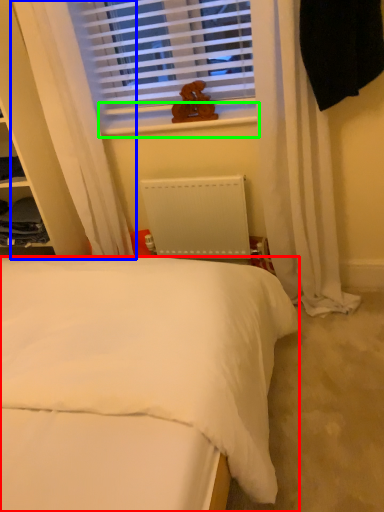
Question: Estimate the real-world distances between objects in this image. Which object is closer to bed (highlighted by a red box), curtain (highlighted by a blue box) or window sill (highlighted by a green box)?

Choices:
 (A) curtain
 (B) window sill

Answer: (A)